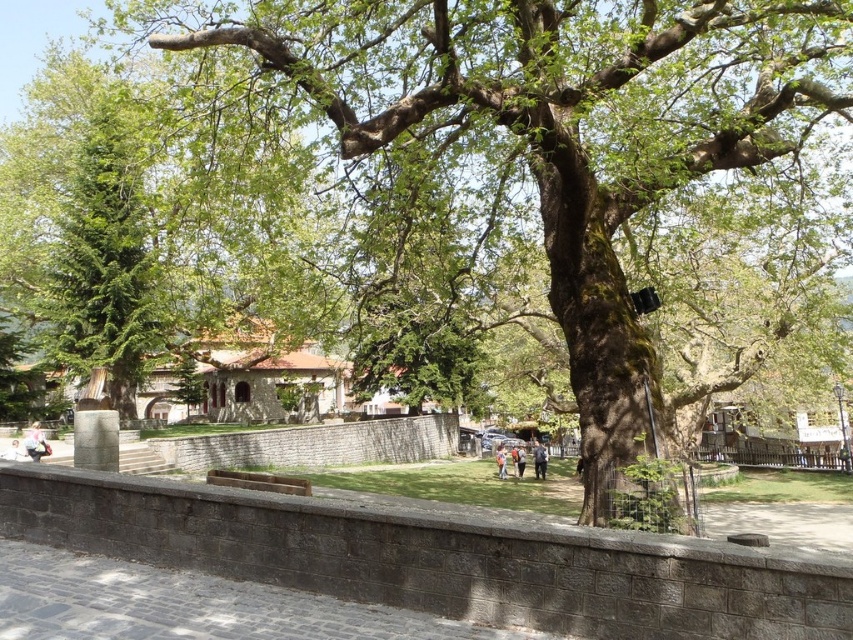
You are standing on the gray cobblestone pavement at lower left and want to place the dark brown leather jacket at center on it. Can the jacket fit on the pavement?

The gray cobblestone pavement at lower left has a smaller size compared to dark brown leather jacket at center, so the jacket cannot fit on the pavement.